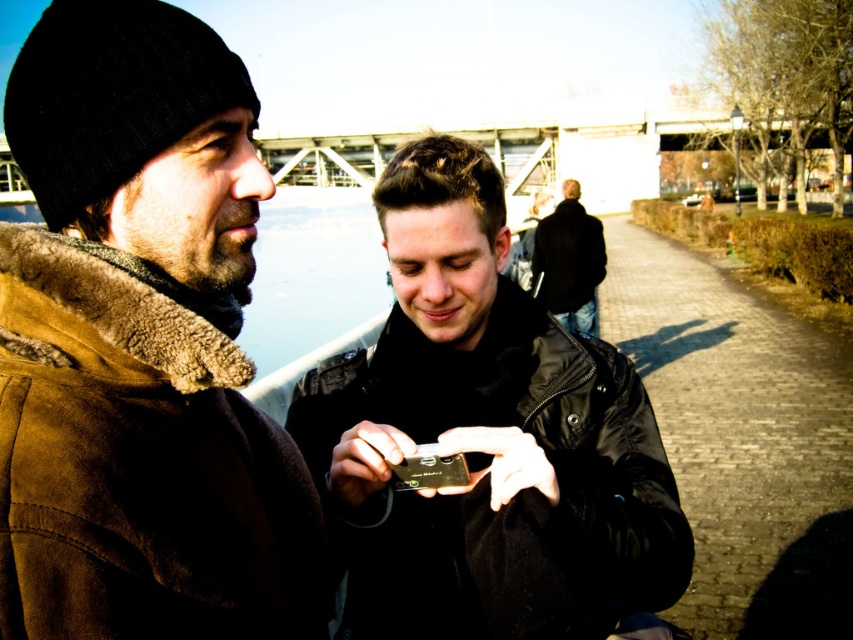
Question: Which point appears farthest from the camera in this image?

Choices:
 (A) (154, 291)
 (B) (569, 275)

Answer: (B)

Question: Does black matte phone at center appear on the right side of black leather jacket at center?

Choices:
 (A) yes
 (B) no

Answer: (B)

Question: Which object appears farthest from the camera in this image?

Choices:
 (A) suede jacket at left
 (B) black matte phone at center

Answer: (B)

Question: Does black matte phone at center come in front of black leather jacket at center?

Choices:
 (A) no
 (B) yes

Answer: (B)

Question: Which of the following is the farthest from the observer?

Choices:
 (A) [x=173, y=467]
 (B) [x=335, y=520]

Answer: (B)

Question: Is suede jacket at left wider than black leather jacket at center?

Choices:
 (A) yes
 (B) no

Answer: (B)